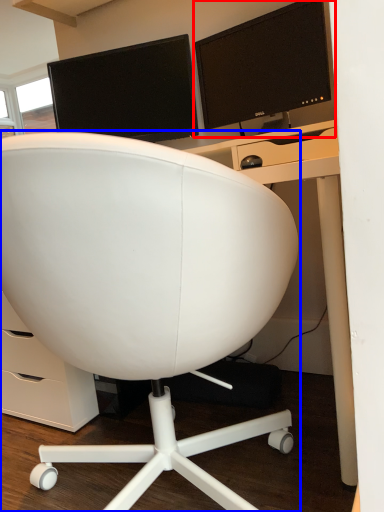
Question: Among these objects, which one is farthest to the camera, computer monitor (highlighted by a red box) or chair (highlighted by a blue box)?

Choices:
 (A) computer monitor
 (B) chair

Answer: (A)